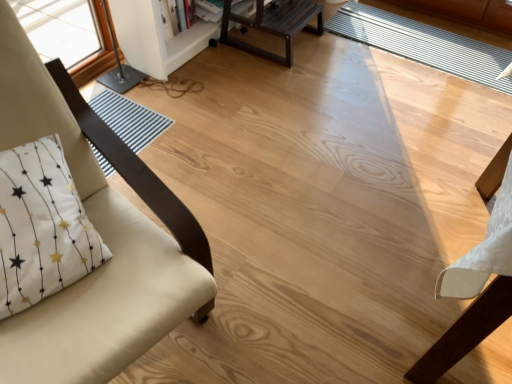
Question: Could you tell me if white painted wood bookshelf at upper center is facing white striped mat at center?

Choices:
 (A) no
 (B) yes

Answer: (B)

Question: Is white painted wood bookshelf at upper center behind white striped mat at center?

Choices:
 (A) no
 (B) yes

Answer: (A)

Question: Is white striped mat at center completely or partially inside white painted wood bookshelf at upper center?

Choices:
 (A) yes
 (B) no

Answer: (B)

Question: Does white painted wood bookshelf at upper center appear on the right side of white striped mat at center?

Choices:
 (A) yes
 (B) no

Answer: (B)

Question: Can you confirm if white painted wood bookshelf at upper center is taller than white striped mat at center?

Choices:
 (A) no
 (B) yes

Answer: (B)

Question: Relative to whitetextured fabricpillow at left, is white striped mat at center in front or behind?

Choices:
 (A) front
 (B) behind

Answer: (B)

Question: Considering the relative positions of white striped mat at center and whitetextured fabricpillow at left in the image provided, is white striped mat at center to the left or to the right of whitetextured fabricpillow at left?

Choices:
 (A) left
 (B) right

Answer: (B)

Question: Is point (349, 36) closer or farther from the camera than point (69, 251)?

Choices:
 (A) closer
 (B) farther

Answer: (B)

Question: Is white striped mat at center bigger or smaller than whitetextured fabricpillow at left?

Choices:
 (A) small
 (B) big

Answer: (A)

Question: Is white painted wood bookshelf at upper center inside the boundaries of white striped mat at center, or outside?

Choices:
 (A) inside
 (B) outside

Answer: (B)

Question: Is point (157, 46) closer or farther from the camera than point (402, 49)?

Choices:
 (A) farther
 (B) closer

Answer: (B)

Question: Is white painted wood bookshelf at upper center taller or shorter than white striped mat at center?

Choices:
 (A) tall
 (B) short

Answer: (A)

Question: From a real-world perspective, is white painted wood bookshelf at upper center positioned above or below white striped mat at center?

Choices:
 (A) below
 (B) above

Answer: (B)

Question: Considering their positions, is white striped mat at center located in front of or behind beige fabric chair at left?

Choices:
 (A) front
 (B) behind

Answer: (B)

Question: From a real-world perspective, is white striped mat at center above or below beige fabric chair at left?

Choices:
 (A) below
 (B) above

Answer: (A)